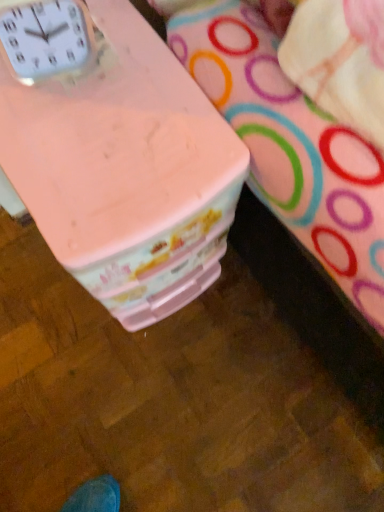
Identify the location of vacant space to the right of white plastic clock at upper left. The image size is (384, 512). (145, 86).